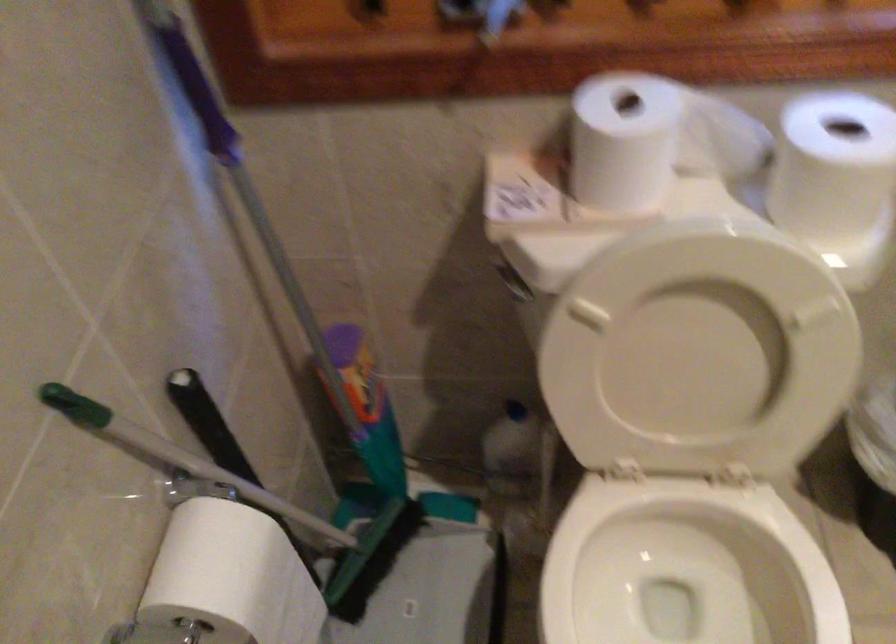
Where would you grip the green brush handle? Please return your answer as a coordinate pair (x, y).

(177, 457)